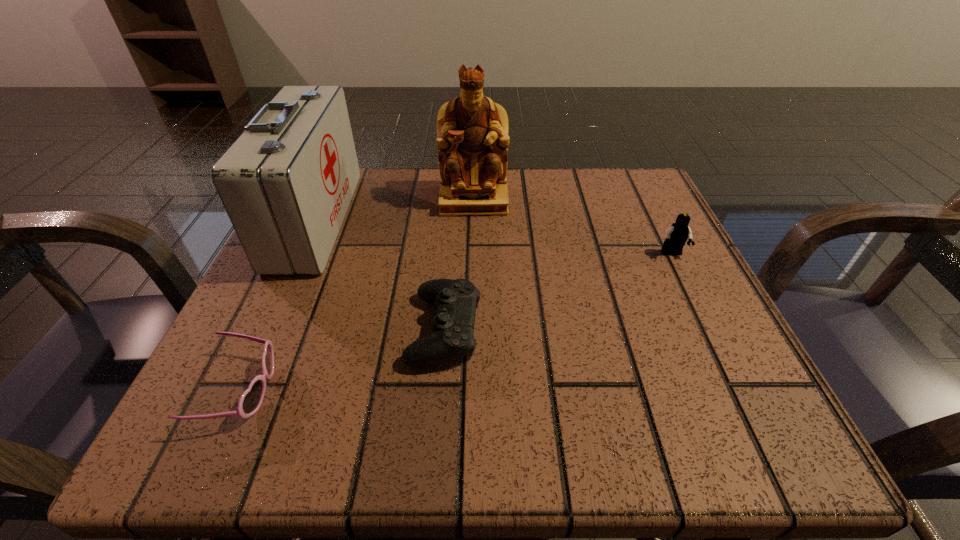
This screenshot has width=960, height=540. I want to click on free location that satisfies the following two spatial constraints: 1. on the front-facing side of the first-aid kit; 2. on the back side of the control, so click(266, 329).

Locate an element on the screen. The height and width of the screenshot is (540, 960). free space that satisfies the following two spatial constraints: 1. on the front-facing side of the figurine; 2. on the front-facing side of the shortest object is located at coordinates (470, 390).

At what (x,y) coordinates should I click in order to perform the action: click on vacant area that satisfies the following two spatial constraints: 1. on the front-facing side of the figurine; 2. on the front-facing side of the shortest object. Please return your answer as a coordinate pair (x, y). The height and width of the screenshot is (540, 960). Looking at the image, I should click on (470, 390).